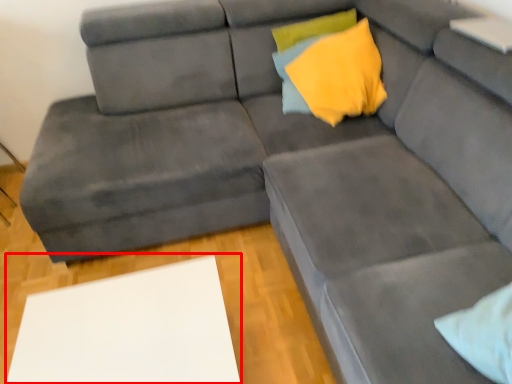
Question: From the image's perspective, considering the relative positions of table (annotated by the red box) and pillow in the image provided, where is table (annotated by the red box) located with respect to the staircase?

Choices:
 (A) above
 (B) below

Answer: (B)